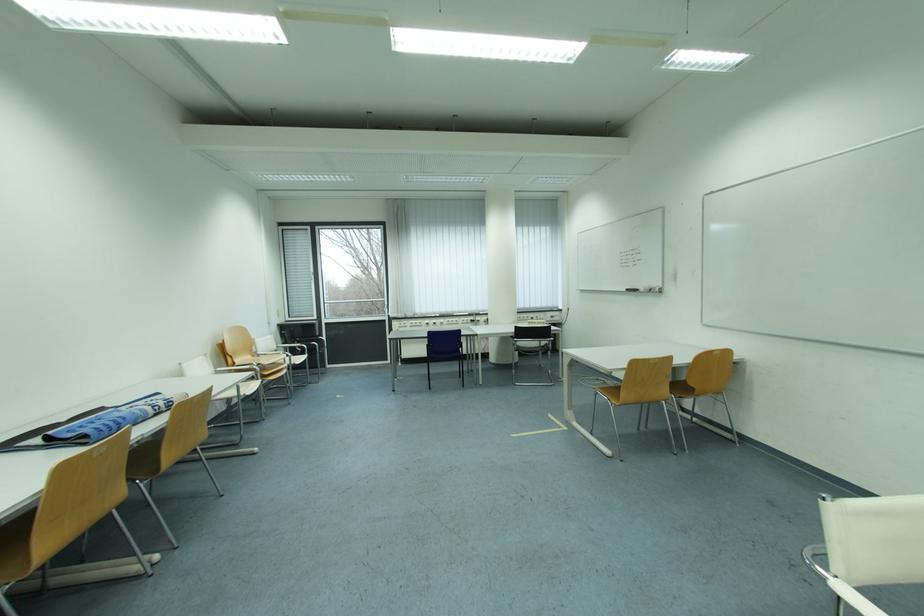
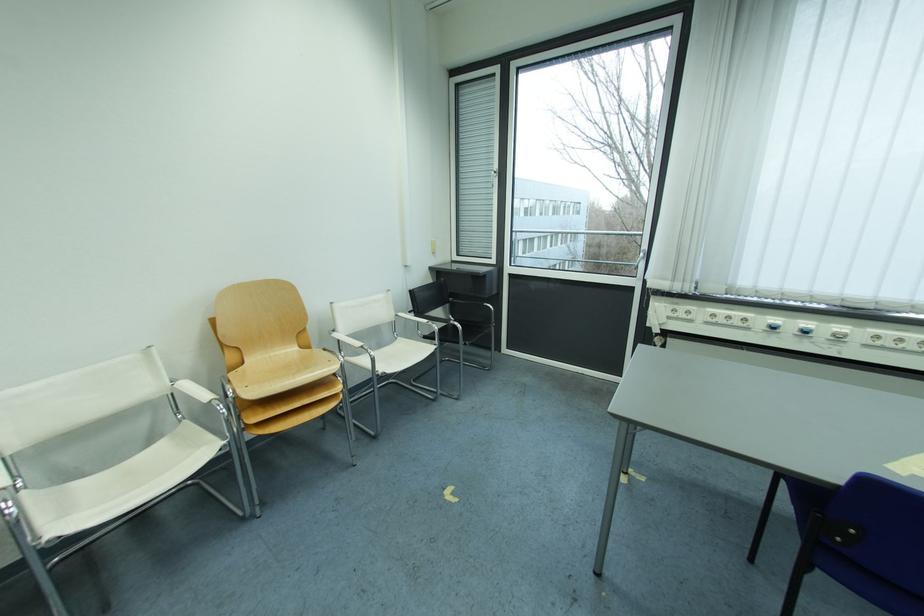
In the second image, find the point that corresponds to point 245,363 in the first image.

(254, 363)